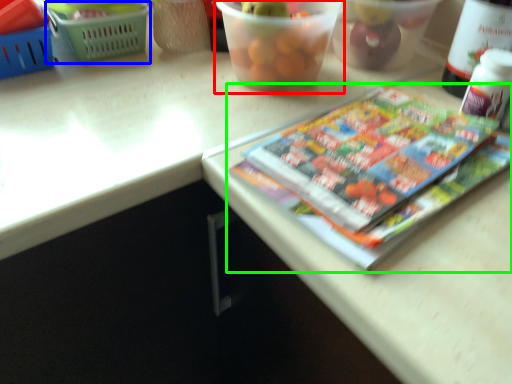
Question: Which object is positioned closest to glass bowl (highlighted by a red box)? Select from basket (highlighted by a blue box) and book (highlighted by a green box).

Choices:
 (A) basket
 (B) book

Answer: (B)